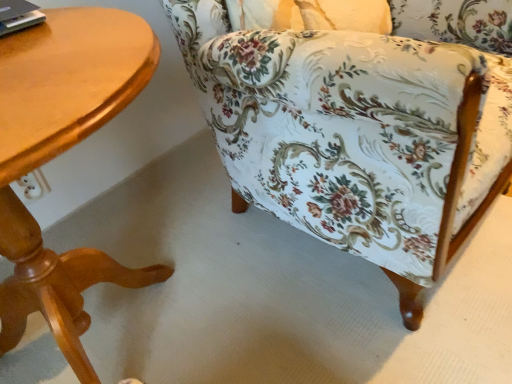
Measure the distance between point (413, 50) and camera.

The distance of point (413, 50) from camera is 20.51 inches.

The image size is (512, 384). Describe the element at coordinates (361, 126) in the screenshot. I see `floral fabric chair at center` at that location.

This screenshot has height=384, width=512. I want to click on floral fabric chair at center, so click(361, 126).

What do you see at coordinates (60, 153) in the screenshot? The image size is (512, 384). I see `wooden table at left` at bounding box center [60, 153].

Where is `wooden table at left`? wooden table at left is located at coordinates (60, 153).

Where is `floral fabric chair at center`? The height and width of the screenshot is (384, 512). floral fabric chair at center is located at coordinates (361, 126).

Which is more to the right, wooden table at left or floral fabric chair at center?

floral fabric chair at center is more to the right.

Does wooden table at left lie behind floral fabric chair at center?

No.

Considering the positions of points (10, 118) and (369, 201), is point (10, 118) farther from camera compared to point (369, 201)?

No, (10, 118) is in front of (369, 201).

From the image's perspective, between wooden table at left and floral fabric chair at center, which one is located above?

floral fabric chair at center.

From a real-world perspective, is wooden table at left over floral fabric chair at center?

Actually, wooden table at left is physically below floral fabric chair at center in the real world.

Can you confirm if wooden table at left is thinner than floral fabric chair at center?

Yes.

Can you confirm if wooden table at left is taller than floral fabric chair at center?

In fact, wooden table at left may be shorter than floral fabric chair at center.

Between wooden table at left and floral fabric chair at center, which one has larger size?

floral fabric chair at center is bigger.

Is wooden table at left spatially inside floral fabric chair at center, or outside of it?

wooden table at left is not enclosed by floral fabric chair at center.

Is wooden table at left in contact with floral fabric chair at center?

Answer: No, wooden table at left is not beside floral fabric chair at center.

Does wooden table at left turn towards floral fabric chair at center?

No.

There is a wooden table at left. At what (x,y) coordinates should I click in order to perform the action: click on chair above it (from a real-world perspective). Please return your answer as a coordinate pair (x, y). The width and height of the screenshot is (512, 384). Looking at the image, I should click on (361, 126).

From the picture: Which is more to the right, floral fabric chair at center or wooden table at left?

floral fabric chair at center.

Is the position of floral fabric chair at center more distant than that of wooden table at left?

That is True.

Which is in front, point (410, 315) or point (86, 46)?

The point (86, 46) is in front.

From the image's perspective, would you say floral fabric chair at center is shown under wooden table at left?

No, from the image's perspective, floral fabric chair at center is not beneath wooden table at left.

From a real-world perspective, is floral fabric chair at center physically located above or below wooden table at left?

From a real-world perspective, floral fabric chair at center is physically above wooden table at left.

Between floral fabric chair at center and wooden table at left, which one has larger width?

floral fabric chair at center is wider.

Considering the sizes of objects floral fabric chair at center and wooden table at left in the image provided, who is shorter, floral fabric chair at center or wooden table at left?

wooden table at left.

Is floral fabric chair at center smaller than wooden table at left?

No.

From the picture: Is floral fabric chair at center situated inside wooden table at left or outside?

floral fabric chair at center lies outside wooden table at left.

Is floral fabric chair at center not close to wooden table at left?

floral fabric chair at center is actually quite close to wooden table at left.

Is floral fabric chair at center looking in the opposite direction of wooden table at left?

floral fabric chair at center is not turned away from wooden table at left.

Consider the image. How different are the orientations of floral fabric chair at center and wooden table at left in degrees?

The angle between the facing direction of floral fabric chair at center and the facing direction of wooden table at left is 0.000221 degrees.

Find the location of a particular element. table located on the left of floral fabric chair at center is located at coordinates (60, 153).

Find the location of a particular element. The width and height of the screenshot is (512, 384). chair that appears on the right of wooden table at left is located at coordinates (361, 126).

Locate an element on the screen. The height and width of the screenshot is (384, 512). table in front of the floral fabric chair at center is located at coordinates tap(60, 153).